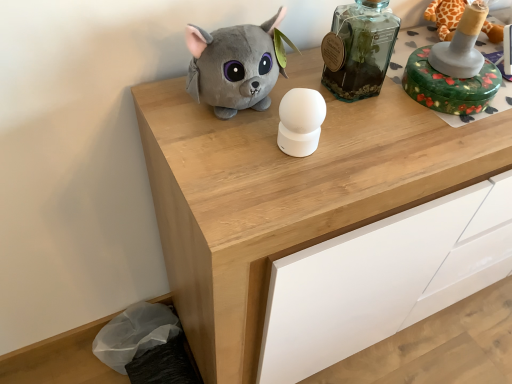
At what (x,y) coordinates should I click in order to perform the action: click on free point in front of transparent glass bottle at upper center. Please return your answer as a coordinate pair (x, y). Looking at the image, I should click on (362, 142).